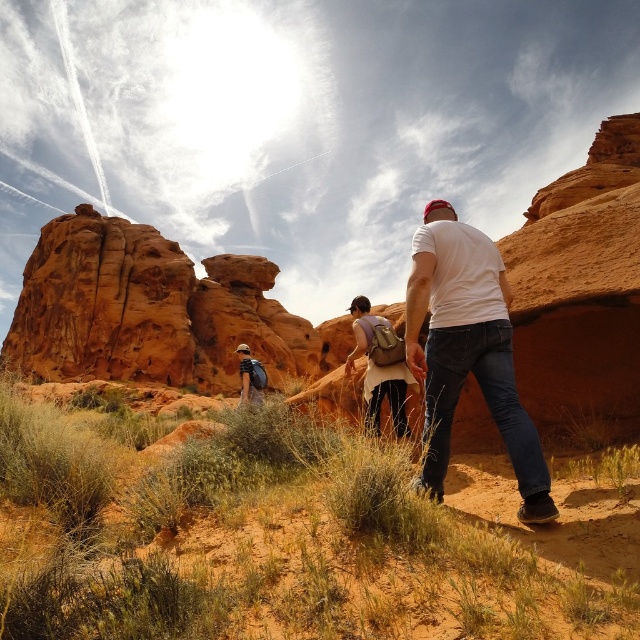
Question: Among these points, which one is nearest to the camera?

Choices:
 (A) (422, 243)
 (B) (13, 452)
 (C) (365, 300)

Answer: (B)

Question: Which object is farther from the camera taking this photo?

Choices:
 (A) desert grass at center
 (B) rustic sandstone rock formation at left
 (C) matte brown backpack at center
 (D) white matte shirt at center

Answer: (B)

Question: Observing the image, what is the correct spatial positioning of rustic sandstone rock formation at left in reference to matte brown backpack at center?

Choices:
 (A) right
 (B) left

Answer: (B)

Question: Is desert grass at center wider than matte brown backpack at center?

Choices:
 (A) yes
 (B) no

Answer: (A)

Question: Which of the following is the closest to the observer?

Choices:
 (A) click(529, 419)
 (B) click(390, 369)
 (C) click(68, 324)
 (D) click(424, 588)

Answer: (D)

Question: Considering the relative positions of desert grass at center and rustic sandstone rock formation at left in the image provided, where is desert grass at center located with respect to rustic sandstone rock formation at left?

Choices:
 (A) above
 (B) below

Answer: (B)